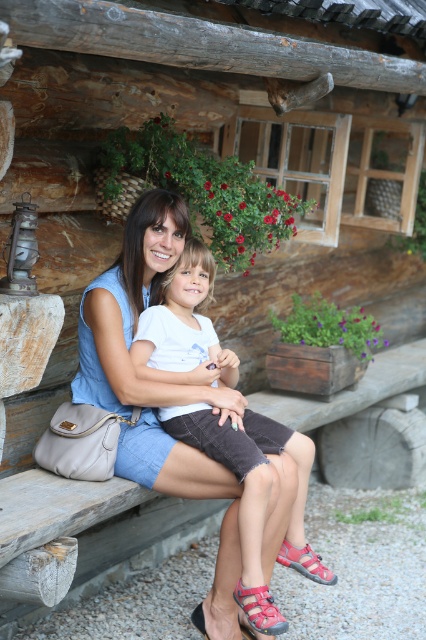
Measure the distance between point (x=209, y=618) and camera.

3.54 meters

Is matte blue dress at center thinner than pink fabric sandal at lower center?

No.

Identify the location of matte blue dress at center. (157, 387).

Locate an element on the screen. This screenshot has width=426, height=640. matte blue dress at center is located at coordinates (157, 387).

Is matte pink sandal at lower center in front of red synthetic sandal at lower center?

No, it is not.

Is matte pink sandal at lower center positioned at the back of red synthetic sandal at lower center?

Yes, it is.

Image resolution: width=426 pixels, height=640 pixels. What are the coordinates of `matte pink sandal at lower center` in the screenshot? It's located at (305, 563).

Locate an element on the screen. The image size is (426, 640). matte pink sandal at lower center is located at coordinates (305, 563).

Who is more forward, (x=271, y=618) or (x=308, y=568)?

Positioned in front is point (x=271, y=618).

Is pink fabric sandal at lower center positioned before matte pink sandal at lower center?

Yes, it is in front of matte pink sandal at lower center.

Describe the element at coordinates (259, 609) in the screenshot. I see `pink fabric sandal at lower center` at that location.

Locate an element on the screen. pink fabric sandal at lower center is located at coordinates (259, 609).